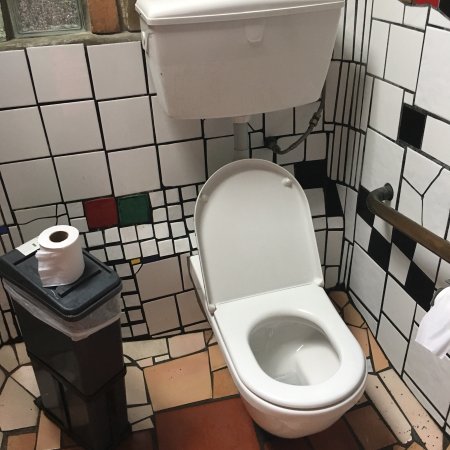
This screenshot has height=450, width=450. In order to click on green wall tile in this screenshot , I will do `click(134, 210)`.